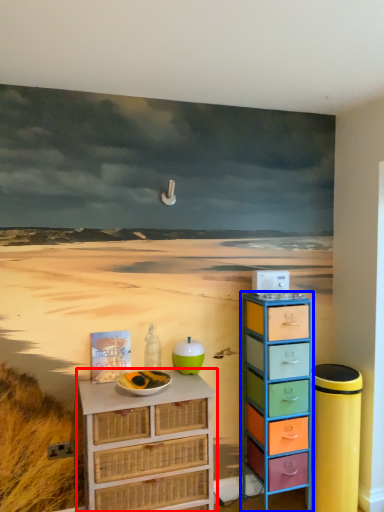
Question: Which of the following is the closest to the observer, chest of drawers (highlighted by a red box) or chest of drawers (highlighted by a blue box)?

Choices:
 (A) chest of drawers
 (B) chest of drawers

Answer: (A)